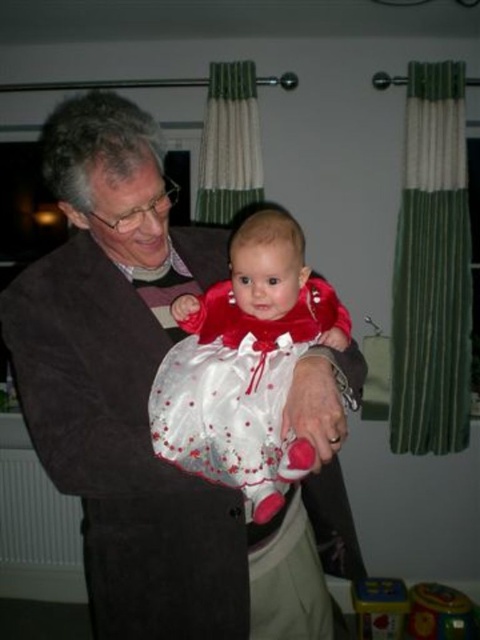
You are a tailor who needs to determine which item requires more fabric between the suede jacket at center and the smooth plastic toy at lower right. Based on their sizes, which one would need more fabric?

The suede jacket at center is larger in size than the smooth plastic toy at lower right, so it would require more fabric.